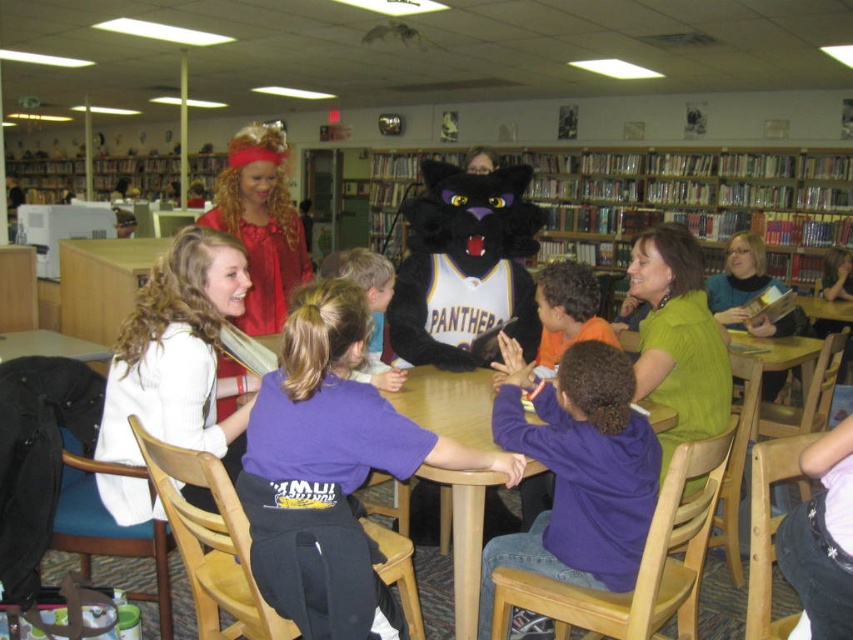
You are a photographer trying to capture a clear shot of both the white sweater at center and the fuzzy black panther at center. Since you want both subjects to appear equally sized in your photo, which one should you move closer to the camera?

The fuzzy black panther at center is smaller than the white sweater at center. To make them appear the same size in the photo, move the fuzzy black panther at center closer to the camera while keeping the white sweater at center at its current distance.

From the picture: You are a photographer trying to capture a photo of the group at the round table. You want to ensure both the purple cotton shirt at center and the white sweater at center are visible in the shot. Based on their positions, which one might you need to ask to move slightly to ensure both are fully visible?

The purple cotton shirt at center is in front of the white sweater at center, so you might need to ask the person wearing the purple cotton shirt at center to move slightly backward or to the side to ensure both are fully visible.